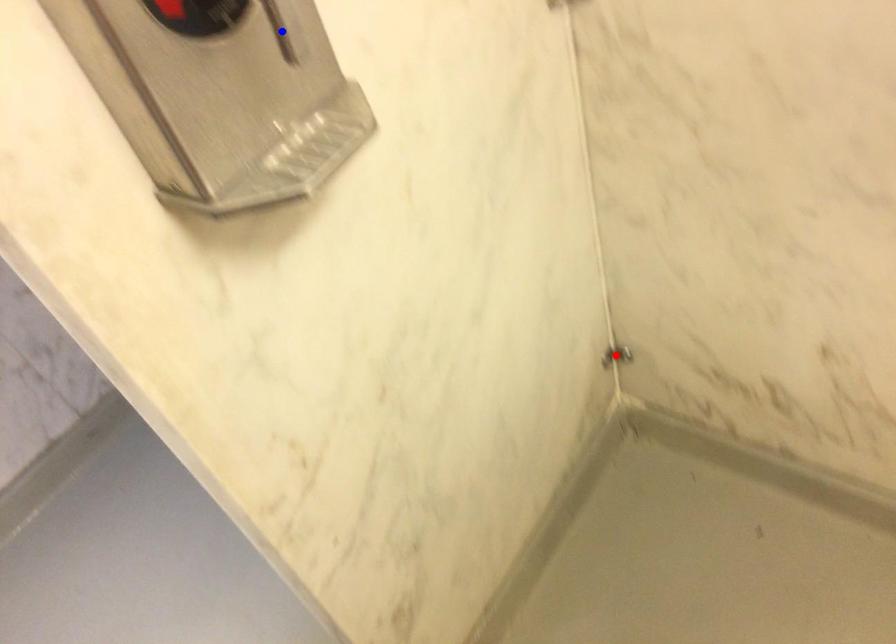
Question: Which of the two points in the image is closer to the camera?

Choices:
 (A) Blue point is closer.
 (B) Red point is closer.

Answer: (A)